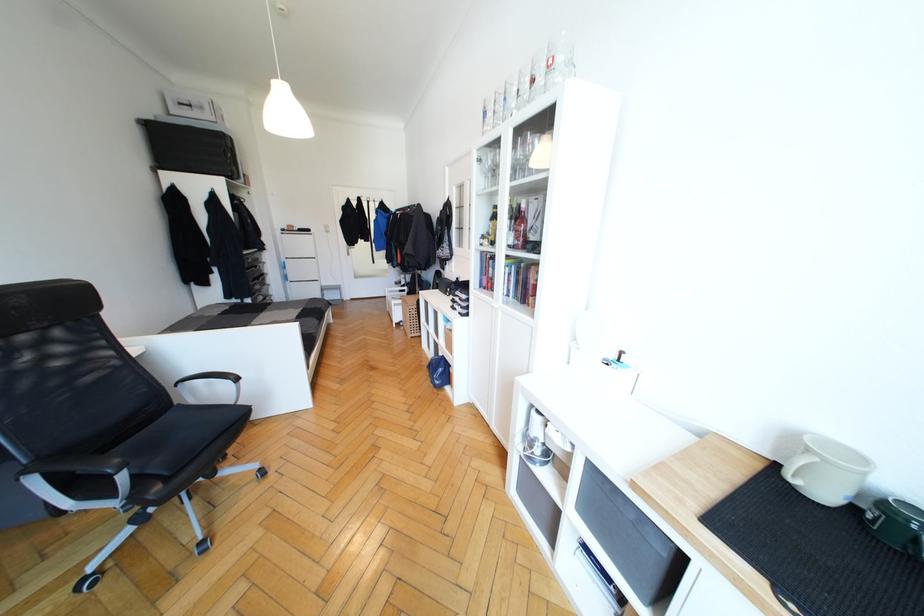
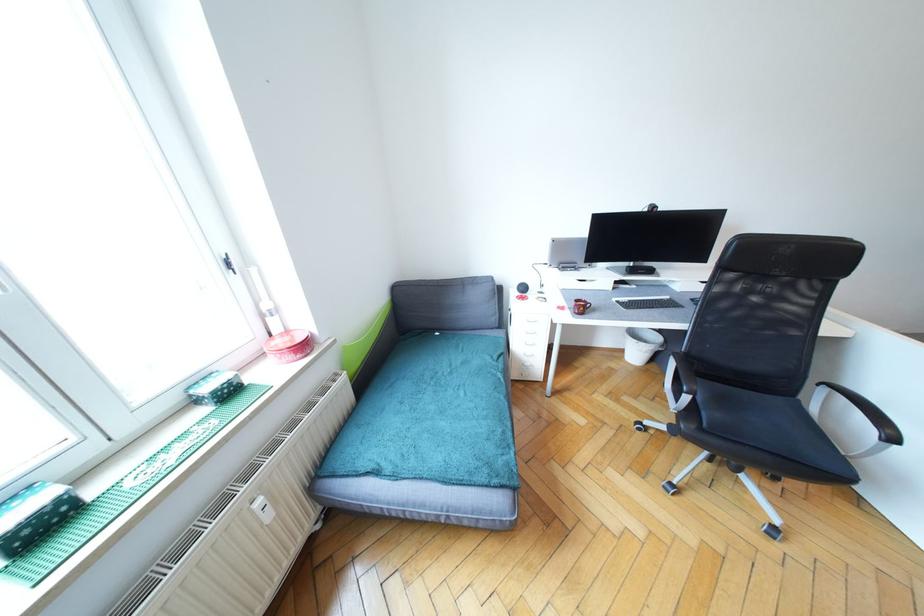
The point at (239, 379) is marked in the first image. Where is the corresponding point in the second image?

(896, 440)